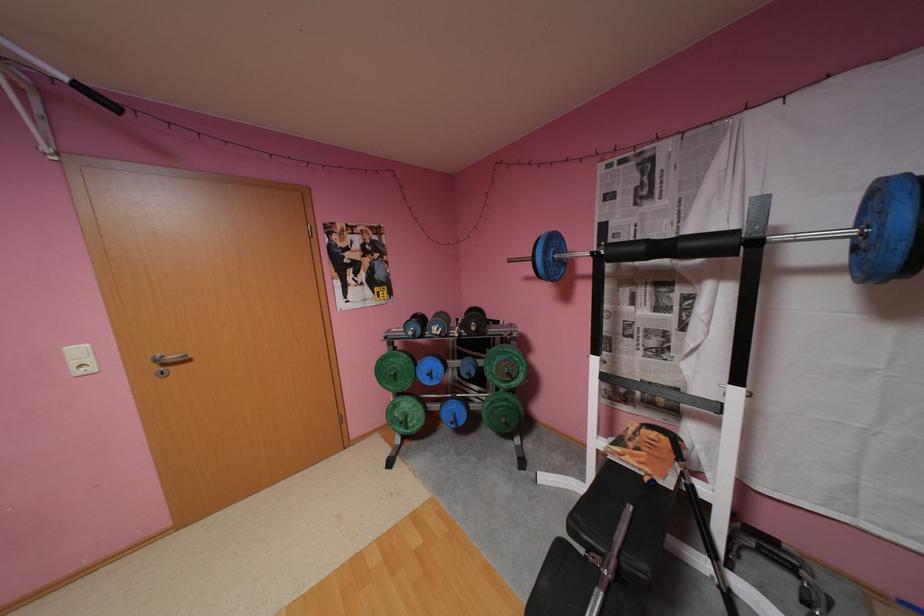
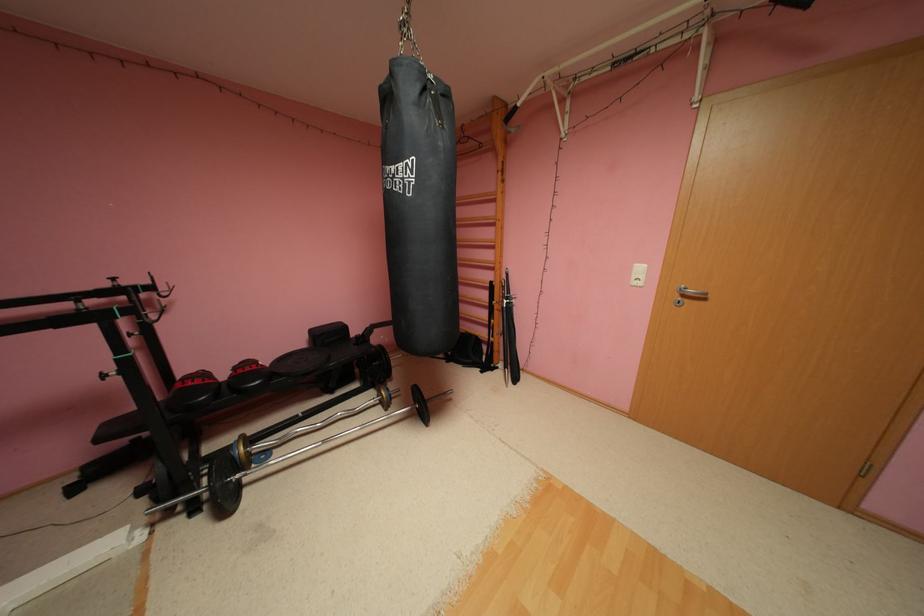
The images are taken continuously from a first-person perspective. In which direction is your viewpoint rotating?

The rotation direction of the camera is left-down.